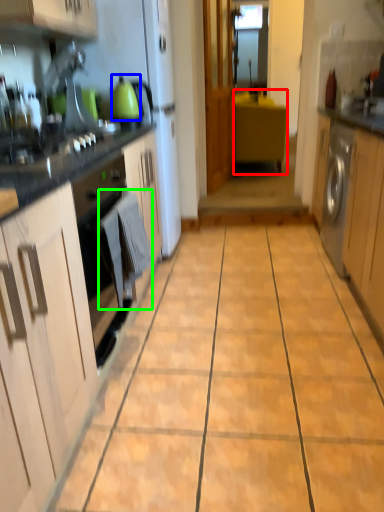
Question: Which object is positioned farthest from cabinetry (highlighted by a red box)? Select from kitchen appliance (highlighted by a blue box) and laundry (highlighted by a green box).

Choices:
 (A) kitchen appliance
 (B) laundry

Answer: (B)